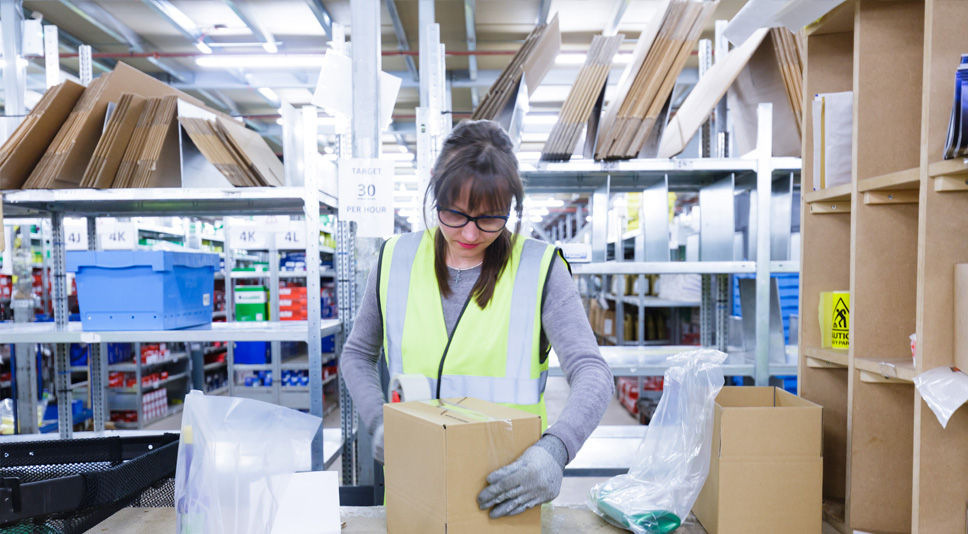
At what (x,y) coordinates should I click in order to perform the action: click on white paper sign. Please return your answer as a coordinate pair (x, y). Image resolution: width=968 pixels, height=534 pixels. Looking at the image, I should click on (366, 186), (301, 235), (248, 239), (126, 235), (73, 234).